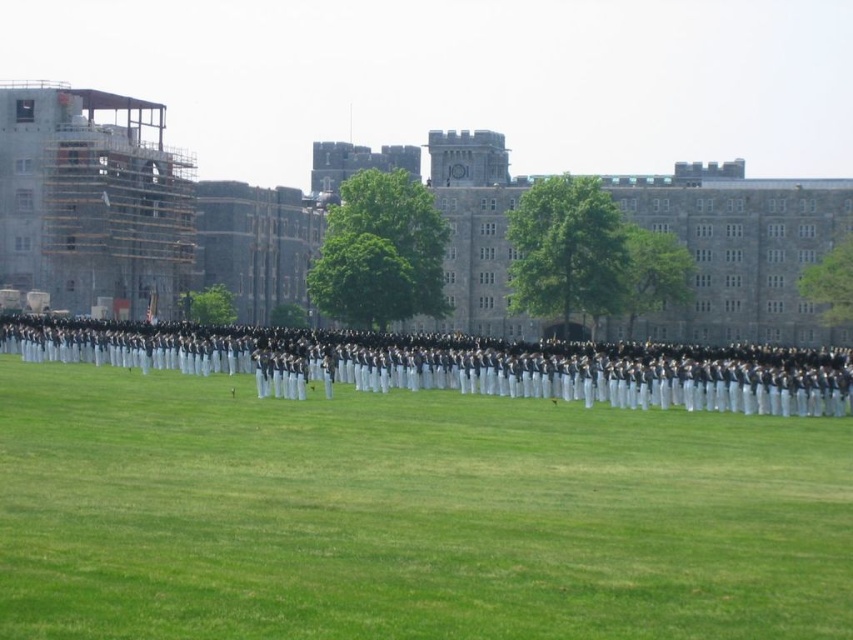
Question: Which of the following is the closest to the observer?

Choices:
 (A) (x=167, y=300)
 (B) (x=30, y=358)
 (C) (x=807, y=548)

Answer: (C)

Question: Which of the following is the closest to the observer?

Choices:
 (A) (612, 387)
 (B) (32, 188)
 (C) (64, 381)
 (D) (757, 260)

Answer: (A)

Question: Which point appears closest to the camera in this image?

Choices:
 (A) (695, 394)
 (B) (207, 541)

Answer: (B)

Question: Does green grass at center have a smaller size compared to scaffolding wood at left?

Choices:
 (A) yes
 (B) no

Answer: (A)

Question: Can you confirm if gray stone building at upper center is smaller than scaffolding wood at left?

Choices:
 (A) no
 (B) yes

Answer: (A)

Question: Can you confirm if dark blue uniform at center is positioned to the left of scaffolding wood at left?

Choices:
 (A) yes
 (B) no

Answer: (B)